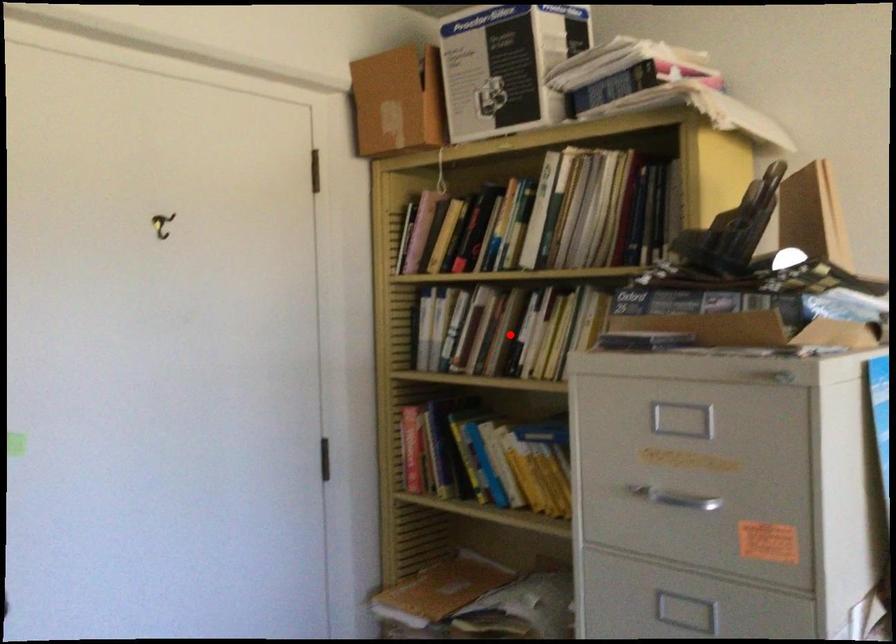
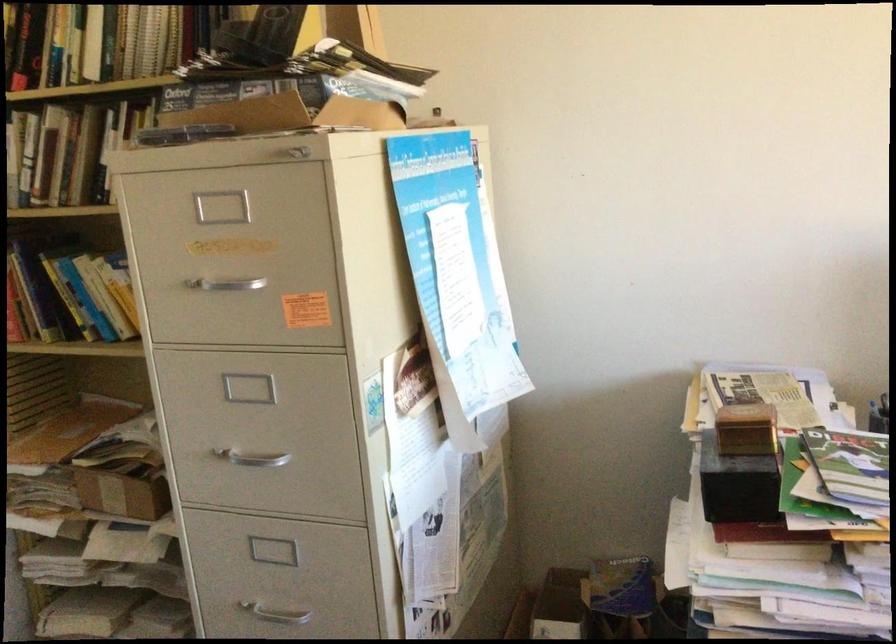
Find the pixel in the second image that matches the highlighted location in the first image.

(83, 156)